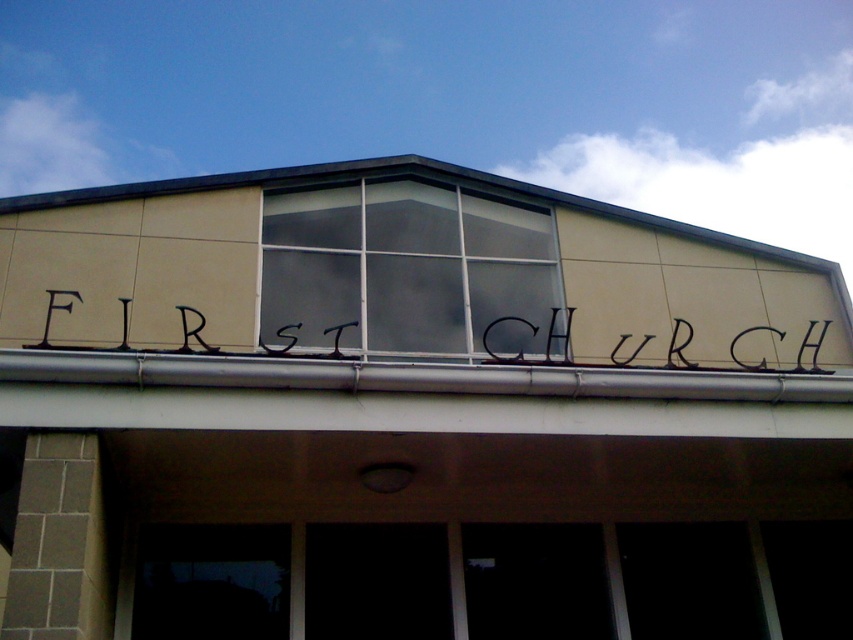
You are standing in front of the building and want to read the text on the black wrought iron sign at center. However, the clear glass window at center is blocking your view. Can you move to the side to see the sign without moving past the window?

The clear glass window at center is taller than the black wrought iron sign at center. Since the window is taller, moving to the side might allow you to see the sign below the window.

You are standing in front of the First Church building and want to determine the relative positions of two points on its facade. The first point is located at coordinates point (x=294, y=337), and the second is at point (x=817, y=321). Which point is closer to you?

Point (x=294, y=337) is closer to the viewer than point (x=817, y=321).

You are an architect reviewing the building facade. You need to determine which object occupies more space on the facade between the clear glass window at center and the black metal sign at upper center. Which one is larger?

The clear glass window at center is larger in size than the black metal sign at upper center, so it occupies more space on the facade.